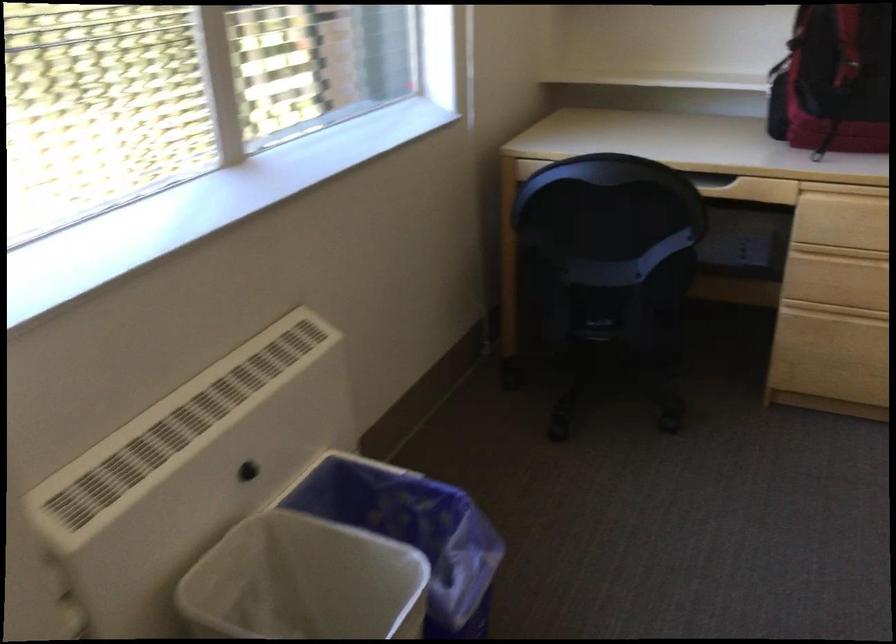
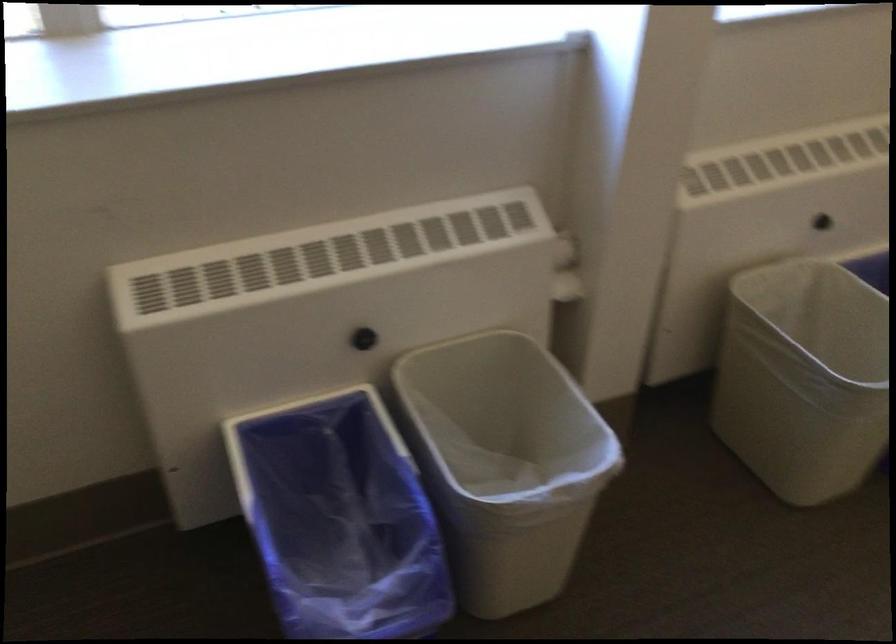
Where in the second image is the point corresponding to point 253,471 from the first image?

(821, 222)